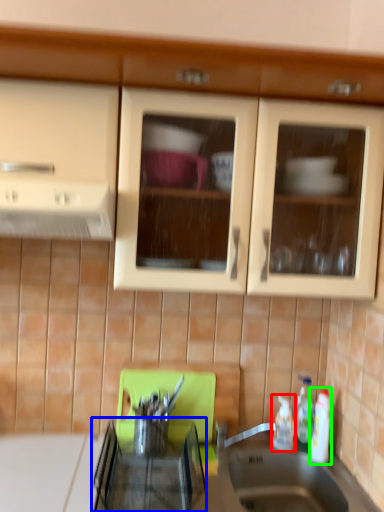
Question: Estimate the real-world distances between objects in this image. Which object is farther from bottle (highlighted by a red box), appliance (highlighted by a blue box) or bottle (highlighted by a green box)?

Choices:
 (A) appliance
 (B) bottle

Answer: (A)